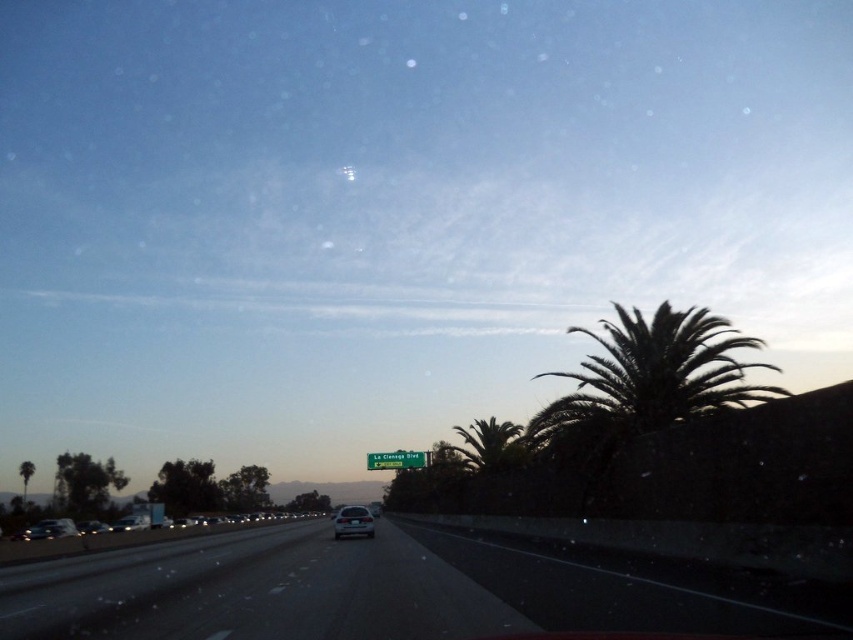
Consider the image. Is the position of shiny silver sedan at lower left more distant than that of green leafy palm tree at left?

No.

How far apart are shiny silver sedan at lower left and green leafy palm tree at left?

They are 167.05 feet apart.

Find the location of a particular element. shiny silver sedan at lower left is located at coordinates (51, 529).

Locate an element on the screen. shiny silver sedan at lower left is located at coordinates (51, 529).

Which of these two, green metallic sign at center or silver metallic sedan at center, stands shorter?

silver metallic sedan at center

Image resolution: width=853 pixels, height=640 pixels. In order to click on green metallic sign at center in this screenshot , I will do `click(397, 460)`.

Describe the element at coordinates (358, 592) in the screenshot. This screenshot has width=853, height=640. I see `black asphalt highway at center` at that location.

Can you confirm if black asphalt highway at center is positioned above green leafy palm tree at center-right?

Correct, black asphalt highway at center is located above green leafy palm tree at center-right.

Which is behind, point (543, 611) or point (463, 454)?

The point (463, 454) is more distant.

In order to click on black asphalt highway at center in this screenshot , I will do `click(358, 592)`.